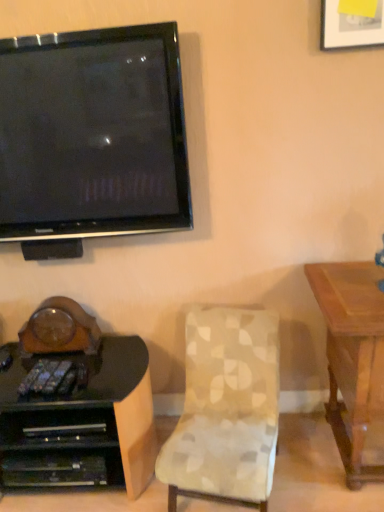
Question: Is black glossy desk at lower left wider or thinner than black glossy television at upper left?

Choices:
 (A) wide
 (B) thin

Answer: (A)

Question: From a real-world perspective, is black glossy desk at lower left above or below black glossy television at upper left?

Choices:
 (A) above
 (B) below

Answer: (B)

Question: Based on their relative distances, which object is nearer to the patterned fabric chair at center?

Choices:
 (A) black glossy television at upper left
 (B) black glossy desk at lower left

Answer: (B)

Question: Considering the real-world distances, which object is farthest from the patterned fabric chair at center?

Choices:
 (A) black glossy desk at lower left
 (B) black glossy television at upper left

Answer: (B)